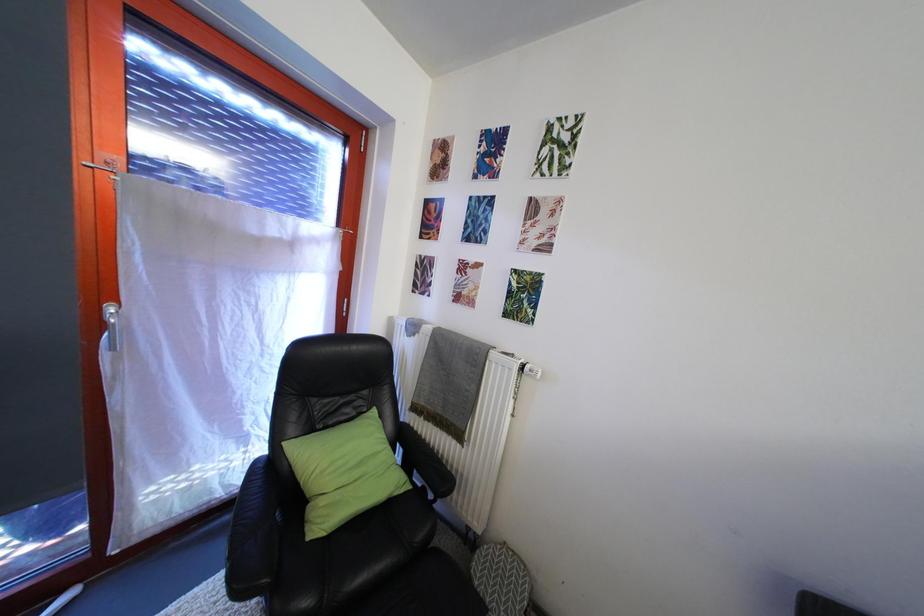
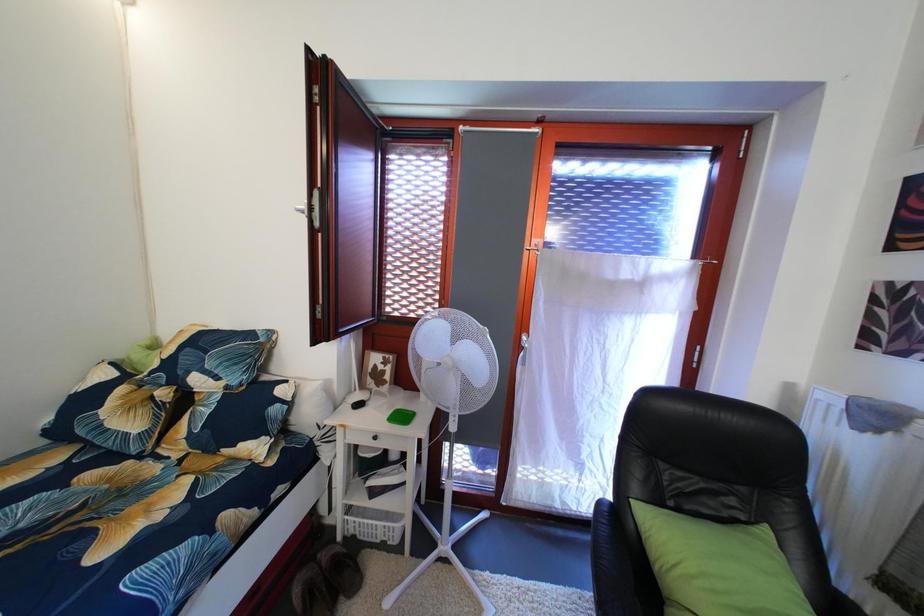
Question: The camera is either moving clockwise (left) or counter-clockwise (right) around the object. The first image is from the beginning of the video and the second image is from the end. Is the camera moving left or right when shooting the video?

Choices:
 (A) Left
 (B) Right

Answer: (B)